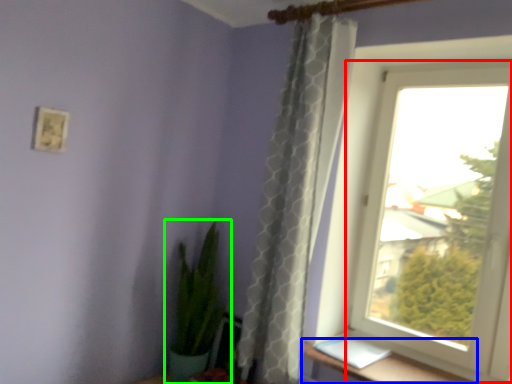
Question: Which is farther away from window (highlighted by a red box)? window sill (highlighted by a blue box) or houseplant (highlighted by a green box)?

Choices:
 (A) window sill
 (B) houseplant

Answer: (B)